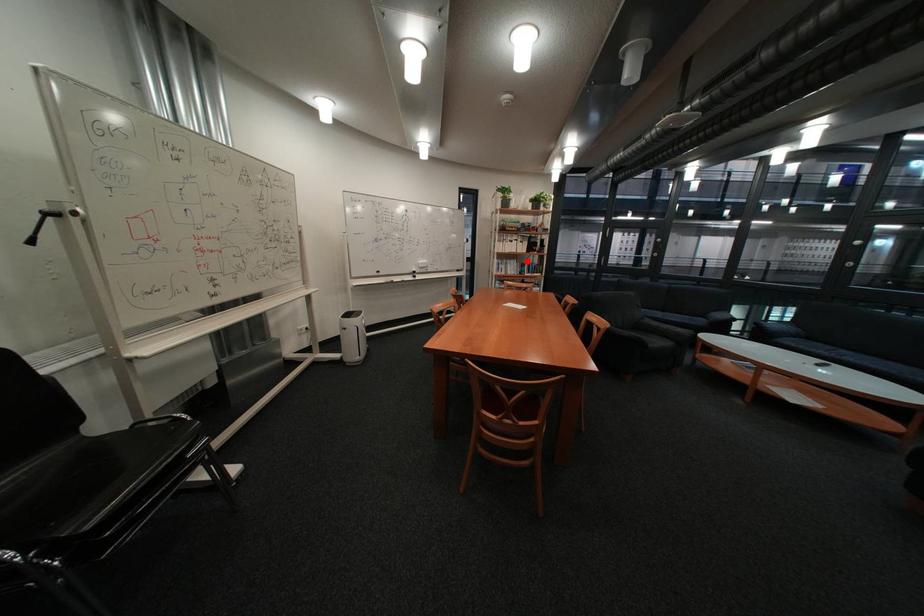
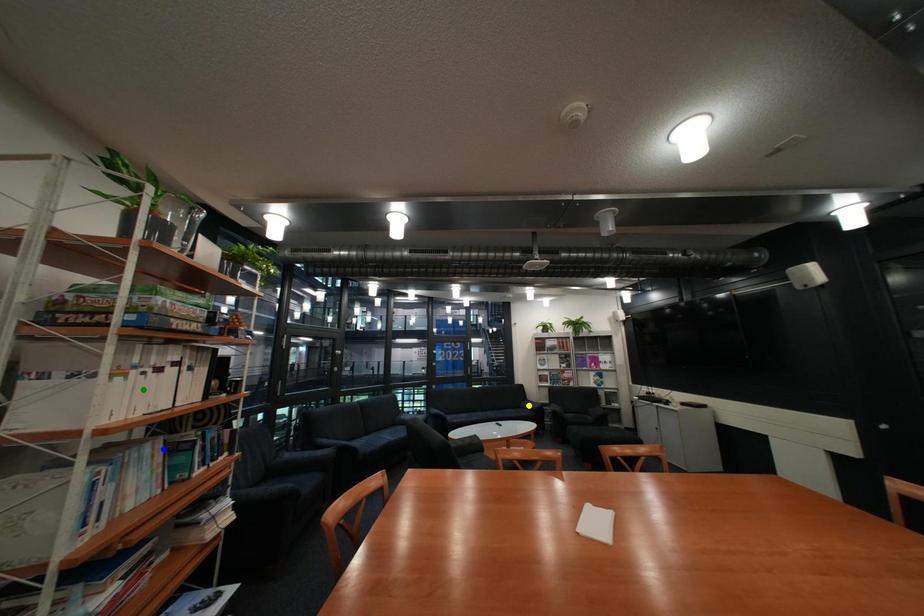
Question: I am providing you with two images of the same scene from different viewpoints. A red point is marked on the first image. You are given multiple points on the second image. In image 2, which mark is for the same physical point as the one in image 1?

Choices:
 (A) yellow point
 (B) blue point
 (C) green point

Answer: (B)